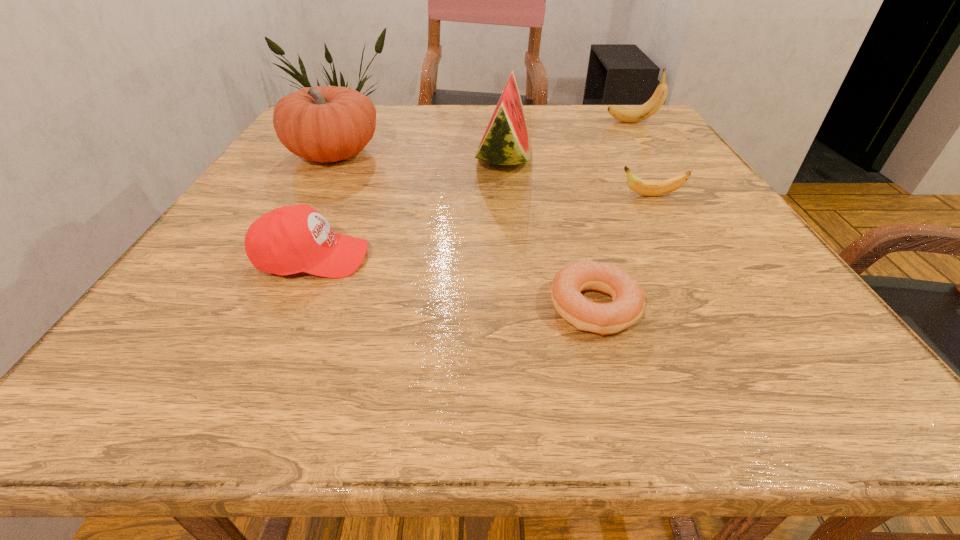
Select which object appears as the closest to the bagel. Please provide its 2D coordinates. Your answer should be formatted as a tuple, i.e. [(x, y)], where the tuple contains the x and y coordinates of a point satisfying the conditions above.

[(647, 188)]

Where is `object that can be found as the third closest to the second shortest object`? object that can be found as the third closest to the second shortest object is located at coordinates (629, 115).

Identify the location of vacant position in the image that satisfies the following two spatial constraints: 1. on the front side of the shortest object; 2. on the right side of the pumpkin. (x=248, y=308).

Find the location of a particular element. Image resolution: width=960 pixels, height=540 pixels. free location that satisfies the following two spatial constraints: 1. at the start of the peel on the farther banana; 2. on the front side of the shortest object is located at coordinates (756, 308).

Locate an element on the screen. The image size is (960, 540). blank area in the image that satisfies the following two spatial constraints: 1. on the front side of the pumpkin; 2. on the left side of the bagel is located at coordinates (248, 308).

Find the location of a particular element. The width and height of the screenshot is (960, 540). vacant area in the image that satisfies the following two spatial constraints: 1. on the front panel of the third shortest object; 2. on the left side of the bagel is located at coordinates (290, 308).